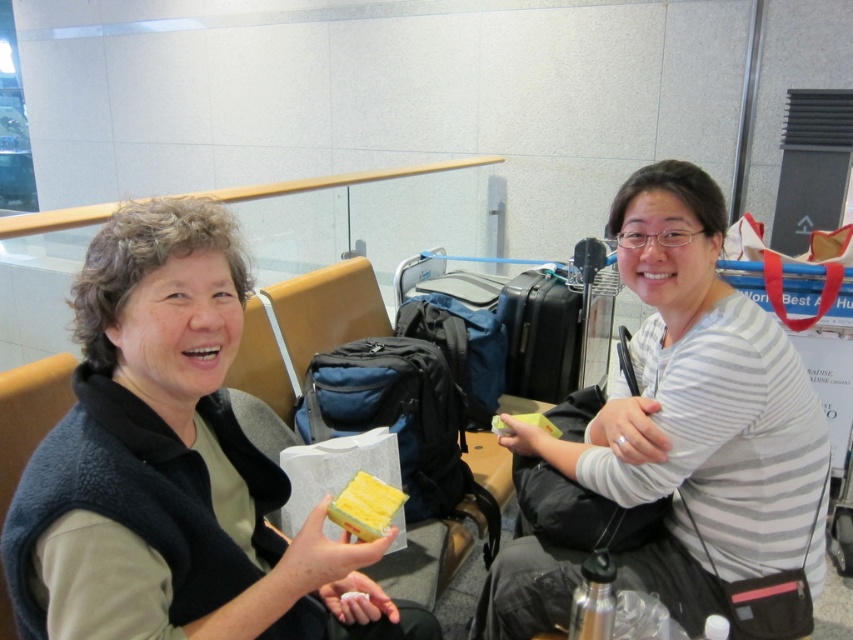
Can you confirm if matte black vest at left is smaller than blue fabric backpack at center?

Incorrect, matte black vest at left is not smaller in size than blue fabric backpack at center.

In the scene shown: Is matte black vest at left closer to camera compared to blue fabric backpack at center?

Yes, matte black vest at left is closer to the viewer.

Image resolution: width=853 pixels, height=640 pixels. Identify the location of matte black vest at left. (173, 467).

Locate an element on the screen. Image resolution: width=853 pixels, height=640 pixels. matte black vest at left is located at coordinates (173, 467).

Consider the image. Which of these two, matte black vest at left or yellow matte soap at center, stands taller?

matte black vest at left is taller.

You are a GUI agent. You are given a task and a screenshot of the screen. Output one action in this format:
    pyautogui.click(x=<x>, y=<y>)
    Task: Click on the matte black vest at left
    
    Given the screenshot: What is the action you would take?
    (173, 467)

From the picture: Can you confirm if black fabric backpack at right is thinner than black hard suitcase at center?

Yes, black fabric backpack at right is thinner than black hard suitcase at center.

Image resolution: width=853 pixels, height=640 pixels. In order to click on black fabric backpack at right in this screenshot , I will do `click(579, 512)`.